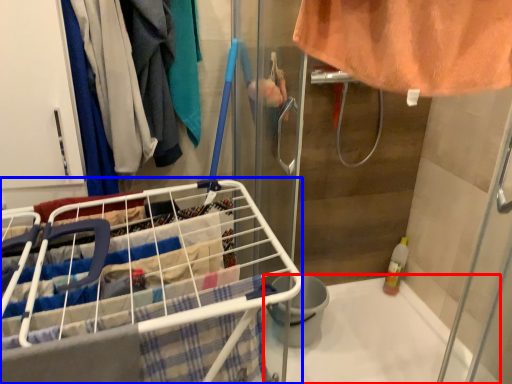
Question: Which object appears farthest to the camera in this image, bath (highlighted by a red box) or shopping cart (highlighted by a blue box)?

Choices:
 (A) bath
 (B) shopping cart

Answer: (A)